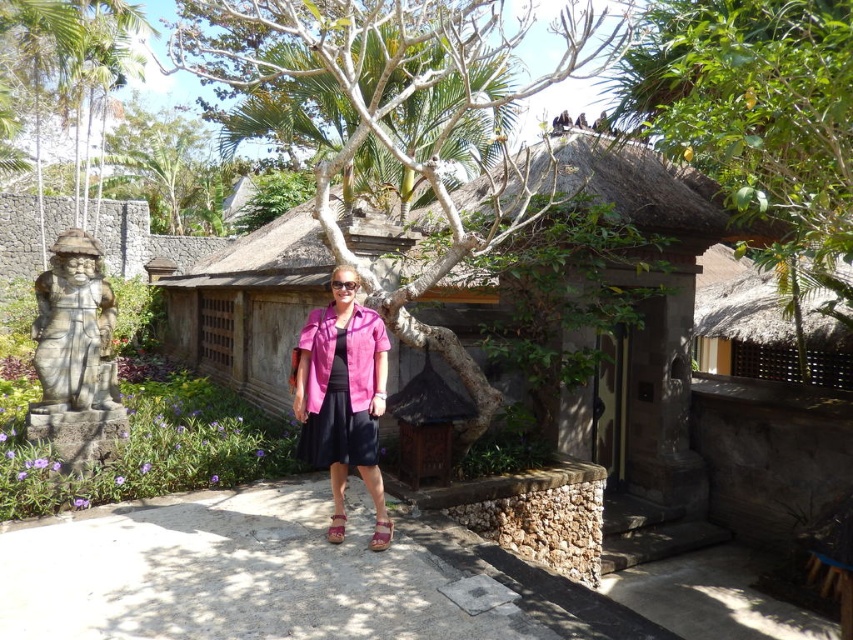
Based on the photo, you are a photographer trying to capture the woman in the bright pink shirt and the rustic thatched roof structure in your shot. You notice two points marked in the scene at coordinates point (415,326) and point (190,144). Which of these points is closer to the camera based on their positions?

Point (415,326) is in front of point (190,144), so it is closer to the camera.

You are a photographer standing at the center of the scene. You want to capture a photo of the woman in front of the rustic structure without the green leafy tree at upper right appearing in the frame. Is the tree currently positioned in a way that would block your desired shot?

The green leafy tree at upper right is located at coordinates point (757, 120), which is outside the central area where the woman and rustic structure are positioned. Therefore, it should not obstruct your shot if you frame the woman and structure centrally.

You are a photographer planning to capture a wide shot of the scene. Given that the green leafy tree at upper right and the stone statue at left are both in the frame, which object would likely occupy more of the photo space?

The green leafy tree at upper right would occupy more space in the photo since it is larger in size than the stone statue at left.